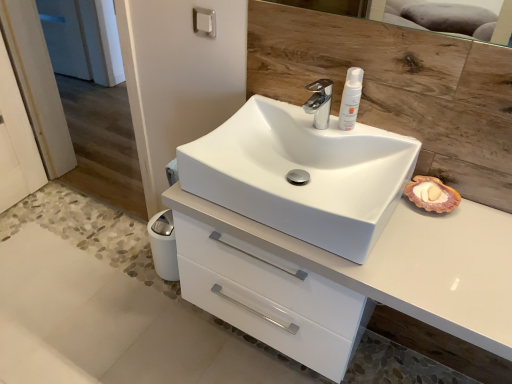
Question: From a real-world perspective, is chrome metallic faucet at center physically below white matte lotion at upper center?

Choices:
 (A) no
 (B) yes

Answer: (B)

Question: Can you confirm if chrome metallic faucet at center is wider than white matte lotion at upper center?

Choices:
 (A) yes
 (B) no

Answer: (A)

Question: Is chrome metallic faucet at center bigger than white matte lotion at upper center?

Choices:
 (A) yes
 (B) no

Answer: (A)

Question: Is chrome metallic faucet at center looking in the opposite direction of white matte lotion at upper center?

Choices:
 (A) yes
 (B) no

Answer: (B)

Question: From the image's perspective, is chrome metallic faucet at center under white matte lotion at upper center?

Choices:
 (A) no
 (B) yes

Answer: (B)

Question: Does chrome metallic faucet at center turn towards white matte lotion at upper center?

Choices:
 (A) no
 (B) yes

Answer: (A)

Question: Does white glossy cabinet at center appear on the right side of white glossy sink at center?

Choices:
 (A) yes
 (B) no

Answer: (A)

Question: Considering the relative sizes of white glossy cabinet at center and white glossy sink at center in the image provided, is white glossy cabinet at center smaller than white glossy sink at center?

Choices:
 (A) no
 (B) yes

Answer: (A)

Question: Is white glossy cabinet at center taller than white glossy sink at center?

Choices:
 (A) yes
 (B) no

Answer: (A)

Question: From the image's perspective, is white glossy cabinet at center below white glossy sink at center?

Choices:
 (A) no
 (B) yes

Answer: (B)

Question: Is white glossy cabinet at center shorter than white glossy sink at center?

Choices:
 (A) yes
 (B) no

Answer: (B)

Question: Does white glossy cabinet at center appear on the left side of white glossy sink at center?

Choices:
 (A) no
 (B) yes

Answer: (A)

Question: From a real-world perspective, is white glossy sink at center under white glossy cabinet at center?

Choices:
 (A) no
 (B) yes

Answer: (A)